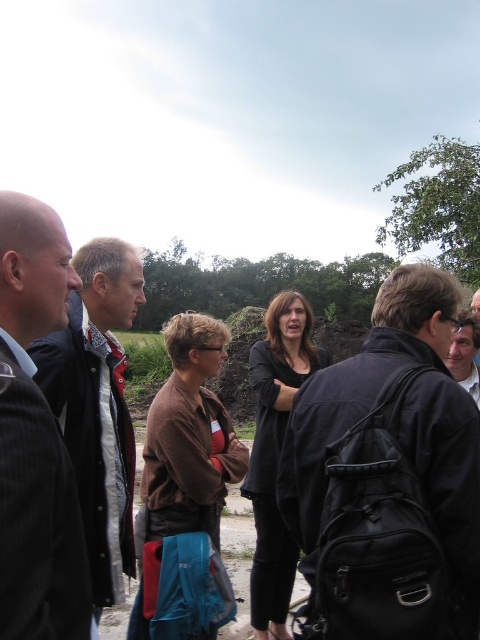
Question: Does black leather backpack at center appear on the right side of dark suit at left?

Choices:
 (A) no
 (B) yes

Answer: (B)

Question: Which point is farther to the camera?

Choices:
 (A) black leather backpack at center
 (B) dark suit at left
 (C) patterned fabric shirt at left
 (D) brown sweater at center

Answer: (D)

Question: Is the position of black leather backpack at center less distant than that of brown sweater at center?

Choices:
 (A) no
 (B) yes

Answer: (B)

Question: Which point is farther to the camera?

Choices:
 (A) matte black backpack at center
 (B) black matte jacket at center
 (C) patterned fabric shirt at left

Answer: (A)

Question: Which object is closer to the camera taking this photo?

Choices:
 (A) matte black backpack at center
 (B) patterned fabric shirt at left
 (C) dark suit at left
 (D) black leather backpack at center

Answer: (C)

Question: Is black leather backpack at center to the left of black matte jacket at center from the viewer's perspective?

Choices:
 (A) yes
 (B) no

Answer: (B)